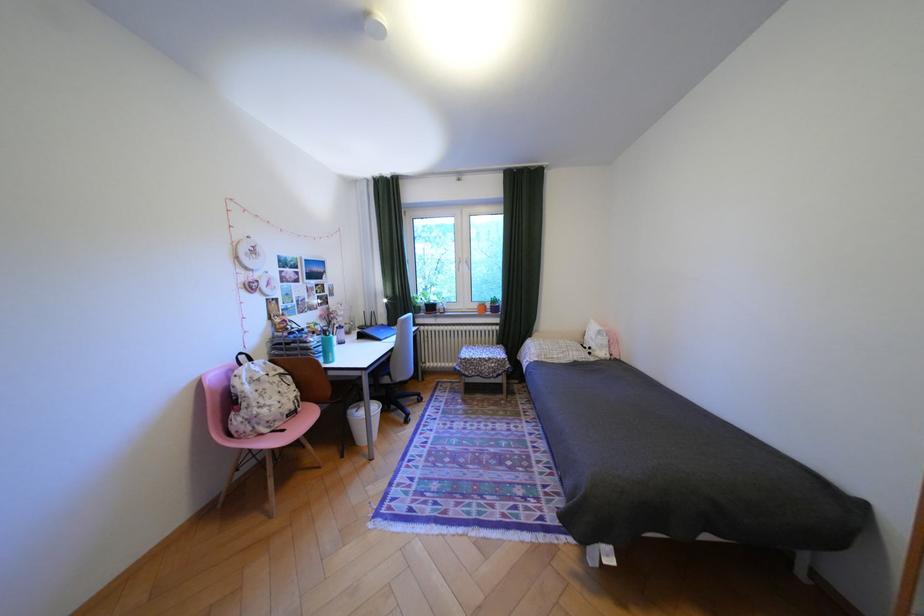
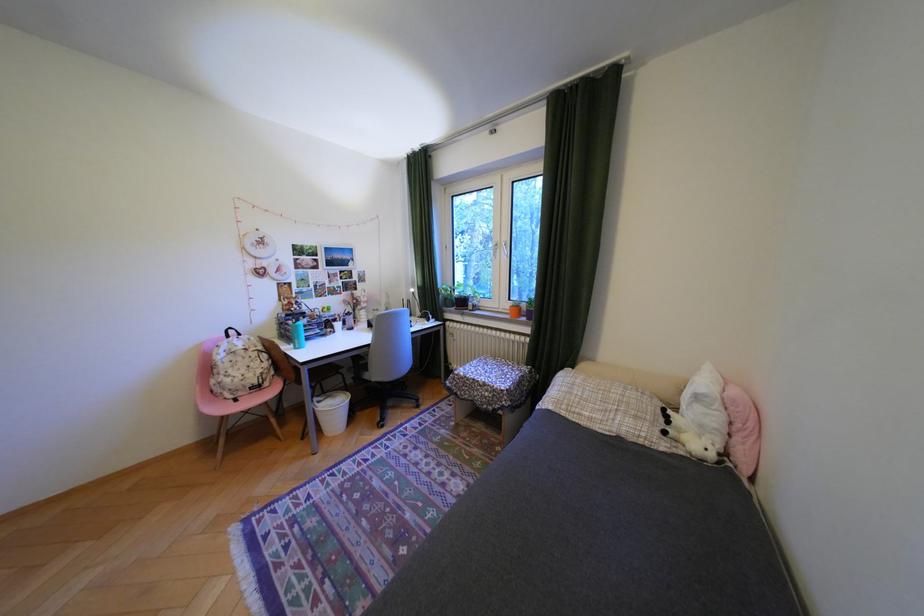
In the second image, find the point that corresponds to (x=276, y=411) in the first image.

(239, 379)